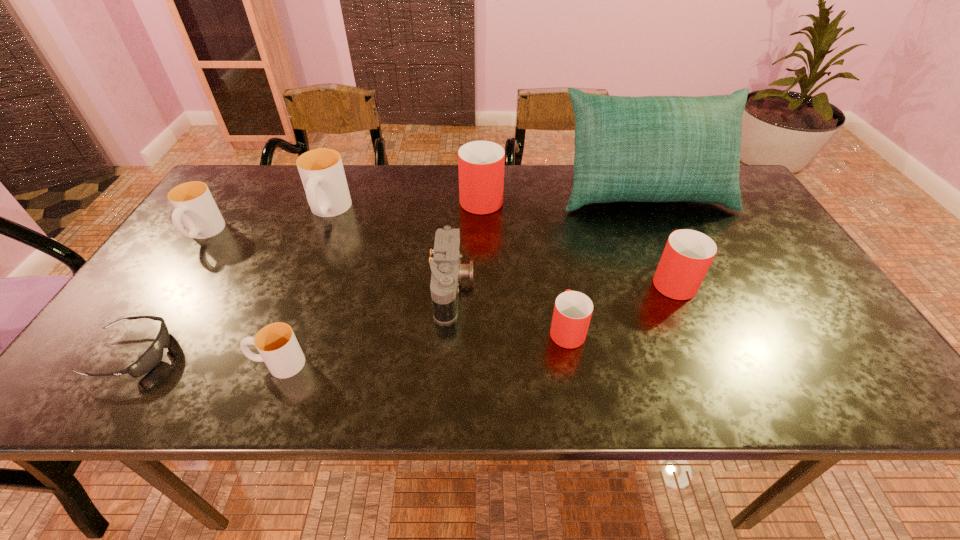
What are the coordinates of `cup at the near edge` in the screenshot? It's located at (278, 347).

You are a GUI agent. You are given a task and a screenshot of the screen. Output one action in this format:
    pyautogui.click(x=<x>, y=<y>)
    Task: Click on the goggles that is at the near edge
    This screenshot has width=960, height=540.
    Given the screenshot: What is the action you would take?
    pyautogui.click(x=153, y=355)

I want to click on cup located at the left edge, so click(194, 205).

This screenshot has width=960, height=540. What are the coordinates of `goggles situated at the left edge` in the screenshot? It's located at (153, 355).

Locate an element on the screen. object that is at the right edge is located at coordinates (651, 148).

What are the coordinates of `object present at the near left corner` in the screenshot? It's located at point(153,355).

Locate an element on the screen. This screenshot has height=540, width=960. object that is at the far right corner is located at coordinates (651, 148).

In the image, there is a desktop. Where is `vacant region at the far edge`? vacant region at the far edge is located at coordinates (438, 199).

Where is `vacant space at the near edge of the desktop`? The height and width of the screenshot is (540, 960). vacant space at the near edge of the desktop is located at coordinates (653, 377).

Where is `vacant region at the left edge of the desktop`? The width and height of the screenshot is (960, 540). vacant region at the left edge of the desktop is located at coordinates (121, 343).